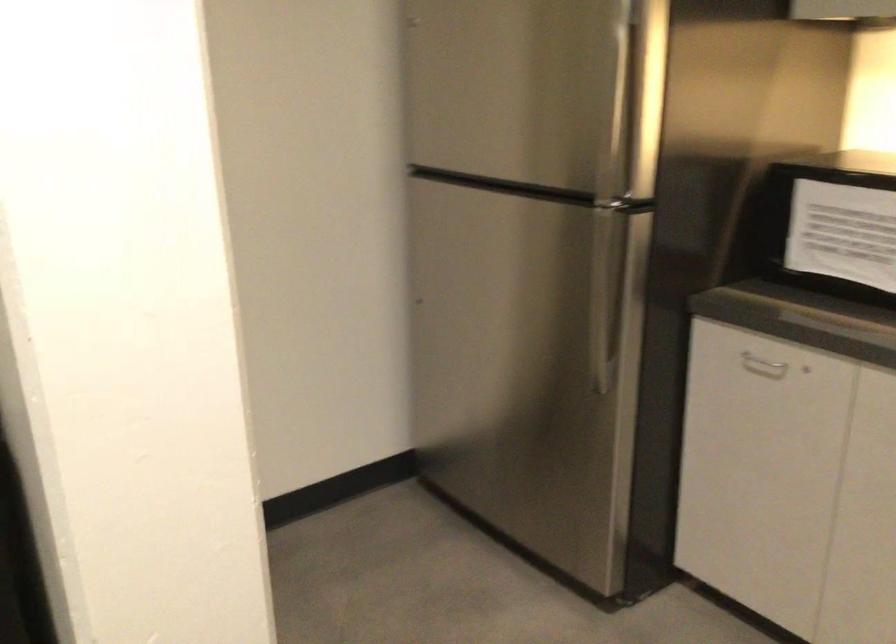
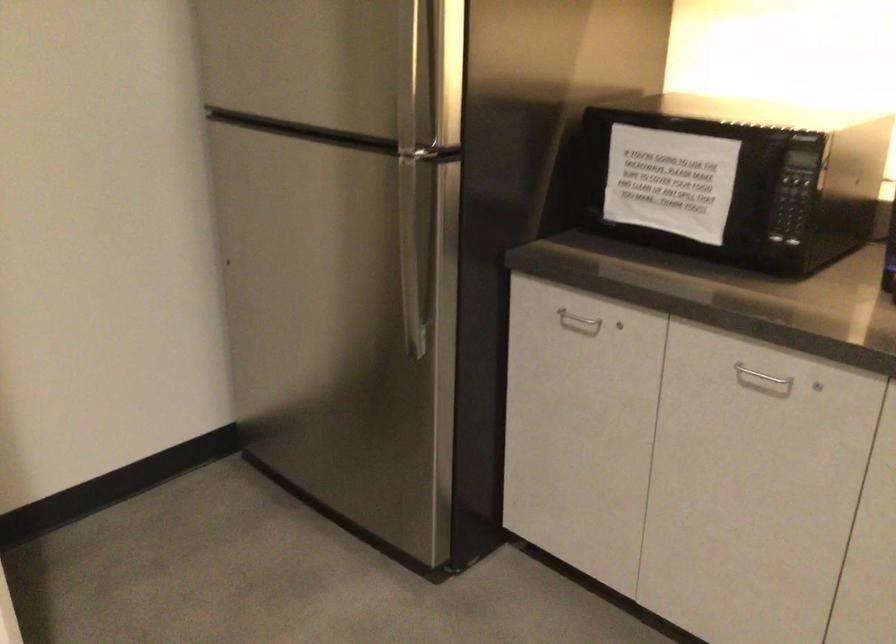
In a continuous first-person perspective shot, in which direction is the camera moving?

The cameraman moved toward right, forward.